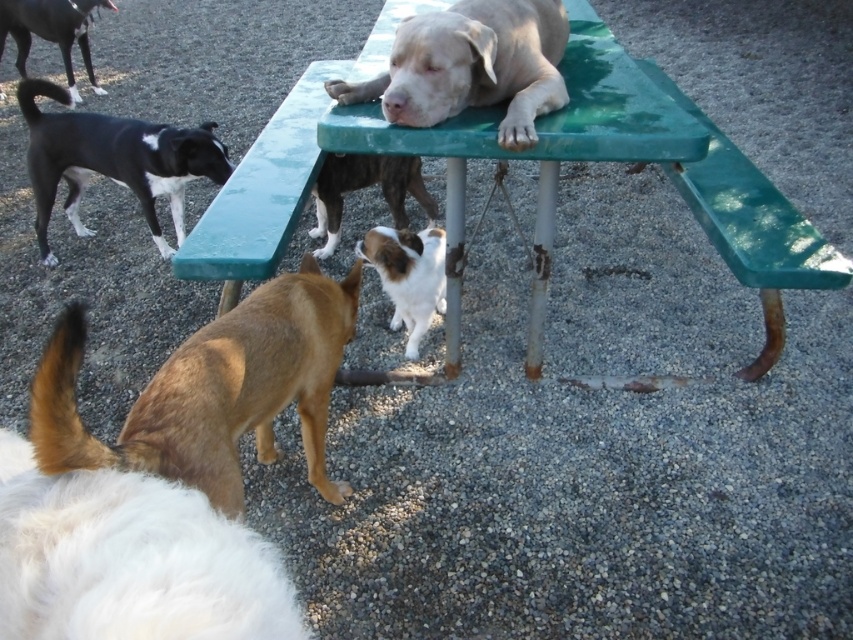
Question: Can you confirm if brown fur dog at lower center is positioned to the left of black and white fur at upper left?

Choices:
 (A) yes
 (B) no

Answer: (B)

Question: Can you confirm if brown fur dog at lower center is positioned above short-haired brown dog at center?

Choices:
 (A) yes
 (B) no

Answer: (B)

Question: Which point is farther to the camera?

Choices:
 (A) (418, 106)
 (B) (413, 243)
 (C) (325, 228)
 (D) (788, 266)

Answer: (C)

Question: Among these points, which one is farthest from the camera?

Choices:
 (A) pyautogui.click(x=277, y=452)
 (B) pyautogui.click(x=247, y=532)

Answer: (A)

Question: Does brown fur dog at lower center appear over light beige smooth dog at upper center?

Choices:
 (A) no
 (B) yes

Answer: (A)

Question: Which of the following is the farthest from the observer?

Choices:
 (A) black and white fur at upper left
 (B) short-haired brown dog at center
 (C) white fluffy dog at lower left
 (D) green plastic picnic table at center

Answer: (A)